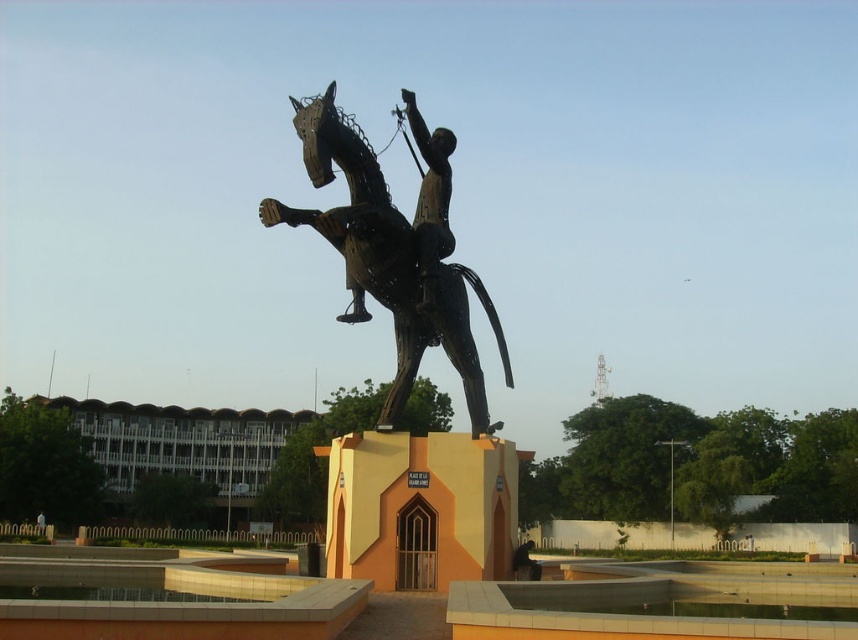
You are a tour guide explaining the statue to visitors. Pointing at the statue, you mention both the black metal horseman at center and the polished bronze rider at center. Which one is positioned lower in the statue?

The black metal horseman at center is positioned lower than the polished bronze rider at center.

You are an art student analyzing the statue composition. You notice two main figures in the center. Which one is bigger between the black metal horseman at center and the polished bronze rider at center?

The black metal horseman at center is larger than the polished bronze rider at center according to the description.

You are standing in a park and see the black metal horseman at center. If you want to take a photo of it from a distance where it will appear small in the frame, would 19.11 meters be a suitable distance?

The distance of black metal horseman at center from viewer is 19.11 meters, so yes, standing at that distance would make the statue appear small in the frame as it is relatively far away.